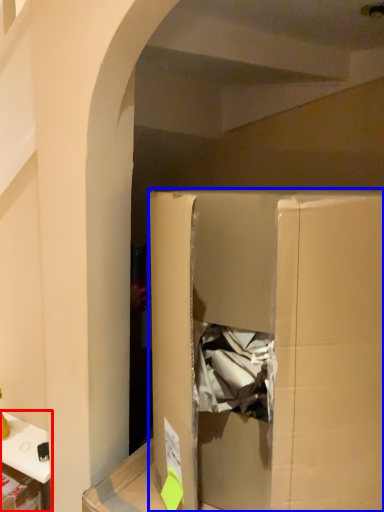
Question: Which object appears closest to the camera in this image, furniture (highlighted by a red box) or cardboard box (highlighted by a blue box)?

Choices:
 (A) furniture
 (B) cardboard box

Answer: (B)